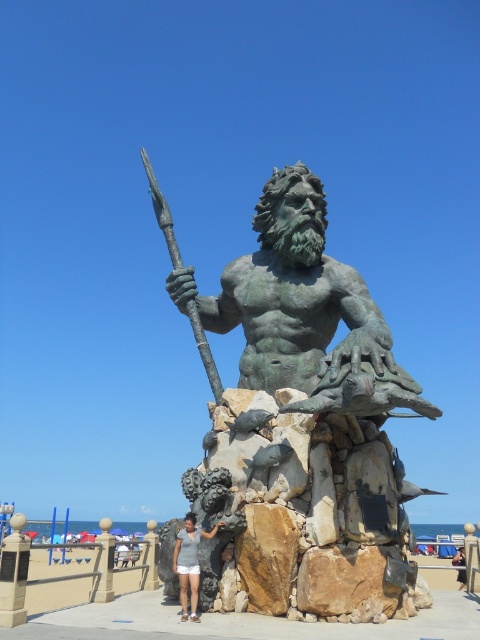
Question: Among these points, which one is farthest from the camera?

Choices:
 (A) (325, 332)
 (B) (186, 573)
 (C) (453, 564)

Answer: (C)

Question: Does green patina statue at center have a smaller size compared to dark gray fabric shirt at center?

Choices:
 (A) no
 (B) yes

Answer: (A)

Question: Which is nearer to the white cotton shorts at center?

Choices:
 (A) dark gray fabric shirt at center
 (B) green patina statue at center

Answer: (B)

Question: Among these objects, which one is nearest to the camera?

Choices:
 (A) dark gray fabric shirt at center
 (B) white cotton shorts at center
 (C) green patina statue at center

Answer: (C)

Question: Can you confirm if green patina statue at center is thinner than white cotton shorts at center?

Choices:
 (A) yes
 (B) no

Answer: (B)

Question: Does green patina statue at center appear on the left side of white cotton shorts at center?

Choices:
 (A) yes
 (B) no

Answer: (B)